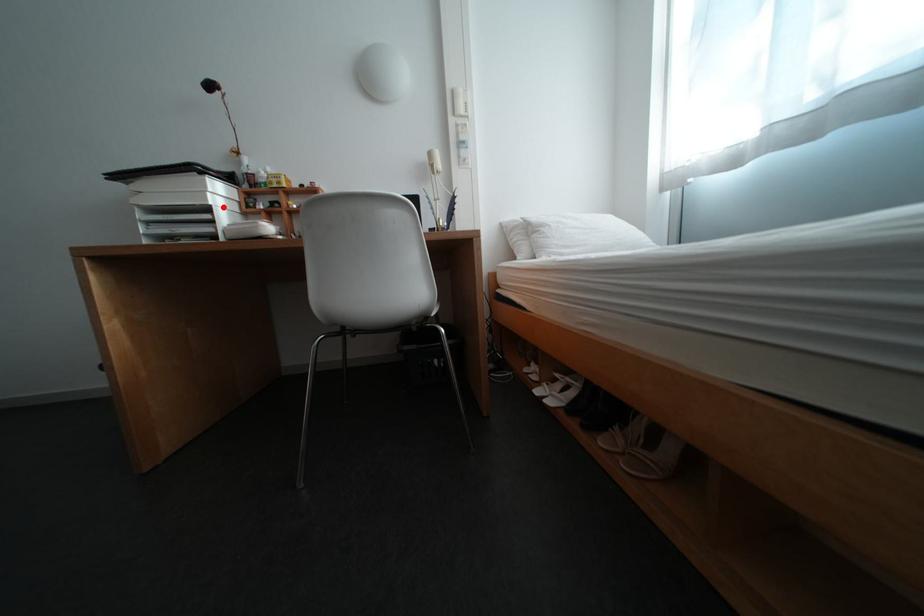
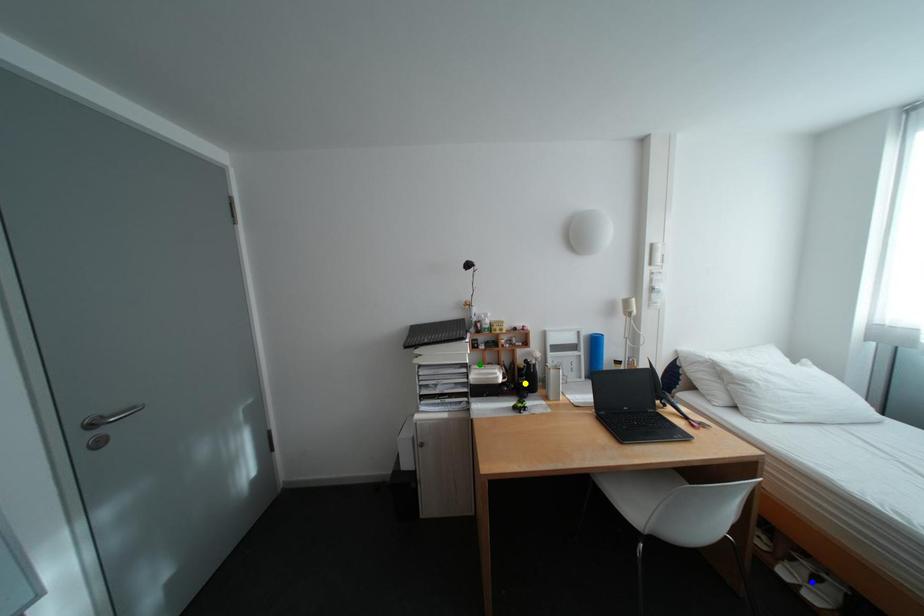
Question: I am providing you with two images of the same scene from different viewpoints. A red point is marked on the first image. You are given multiple points on the second image. Which spot in image 2 lines up with the point in image 1?

Choices:
 (A) green point
 (B) blue point
 (C) yellow point

Answer: (A)